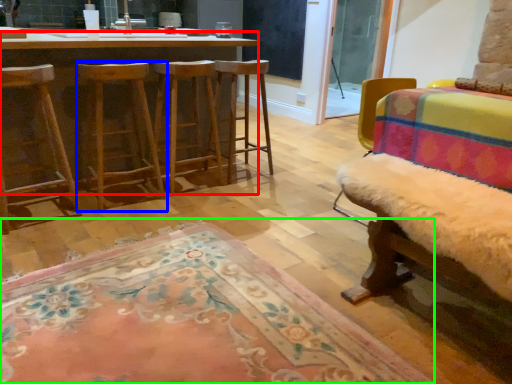
Question: Based on their relative distances, which object is farther from desk (highlighted by a red box)? Choose from stool (highlighted by a blue box) and mat (highlighted by a green box).

Choices:
 (A) stool
 (B) mat

Answer: (B)